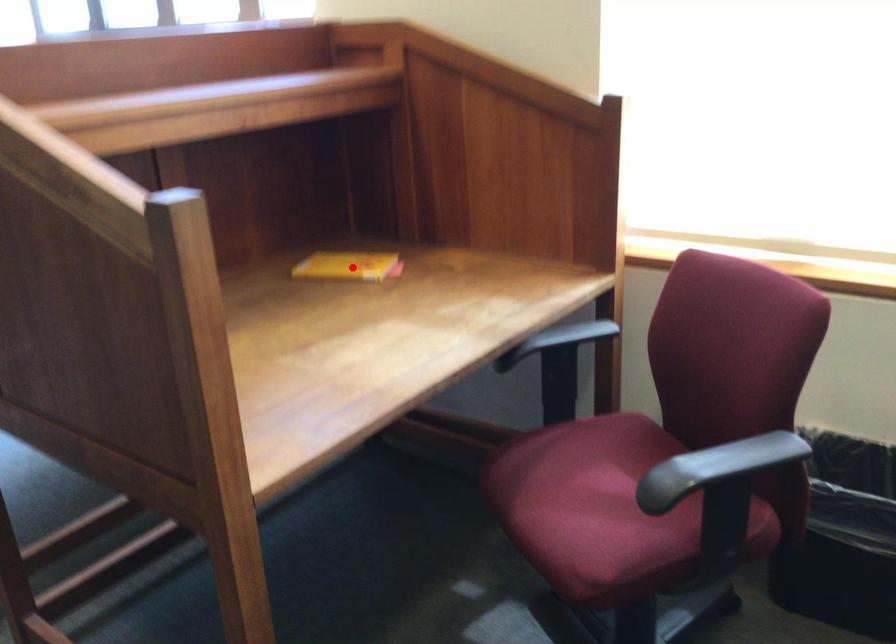
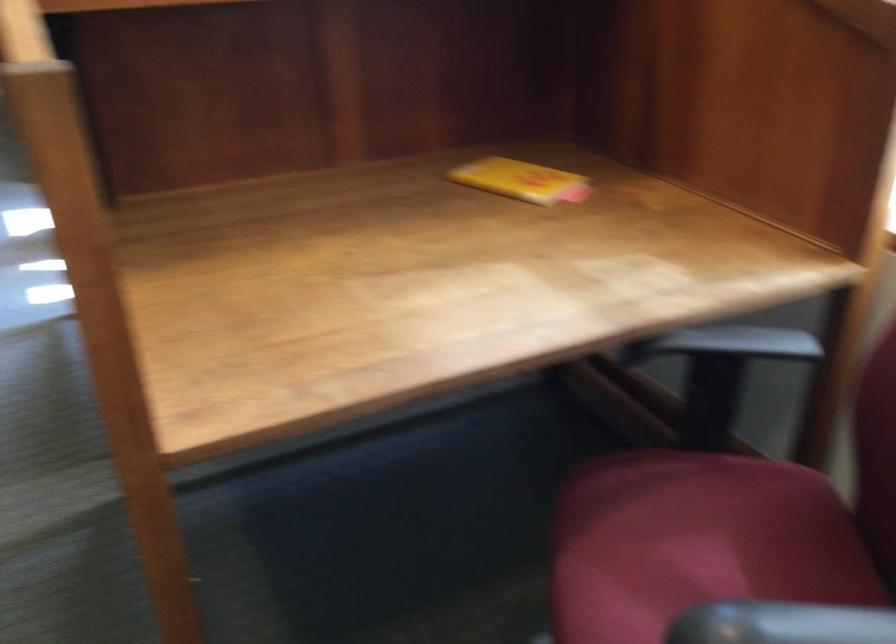
Question: A red point is marked in image1. In image2, is the corresponding 3D point closer to the camera or farther? Reply with the corresponding letter.

Choices:
 (A) The corresponding 3D point is closer.
 (B) The corresponding 3D point is farther.

Answer: (A)